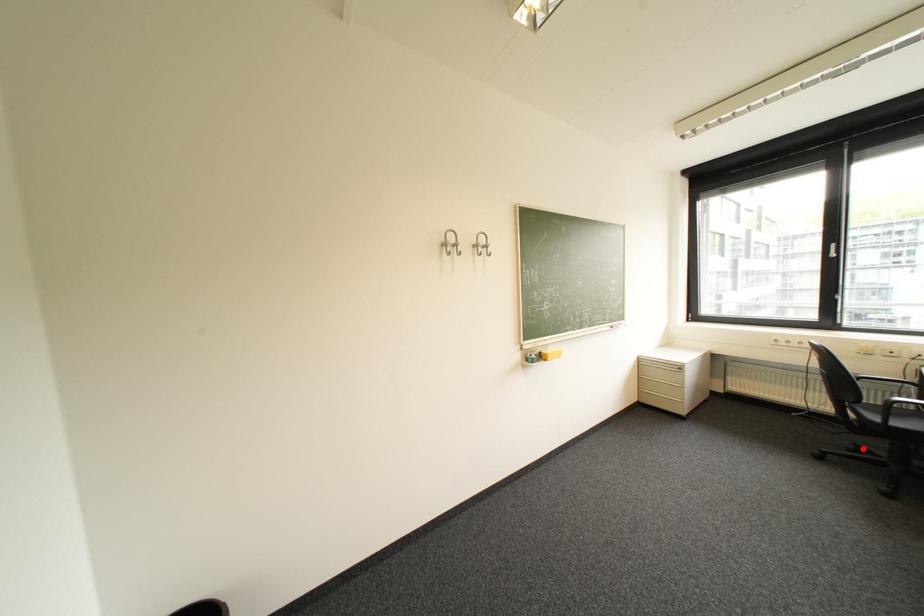
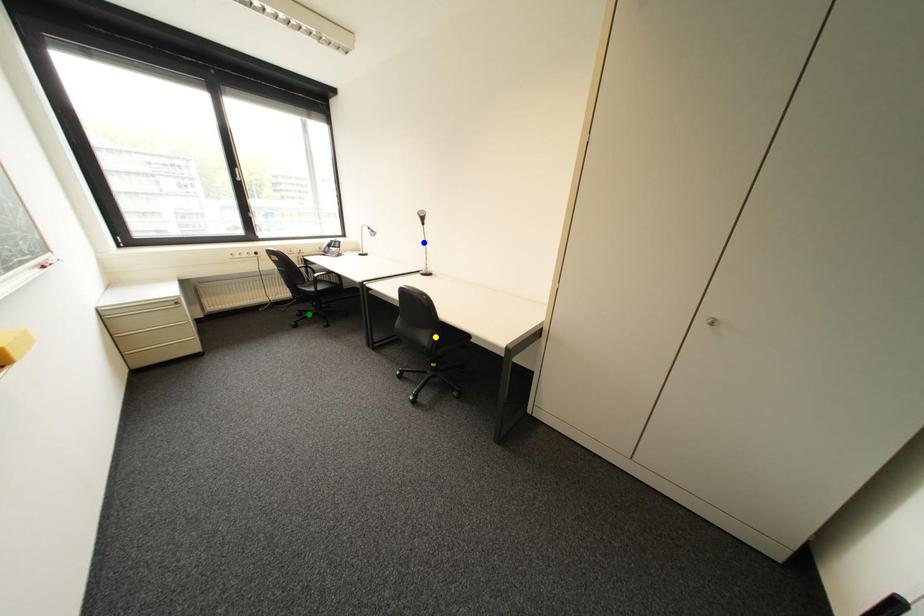
Question: I am providing you with two images of the same scene from different viewpoints. A red point is marked on the first image. You are given multiple points on the second image. Which spot in image 2 lines up with the point in image 1?

Choices:
 (A) yellow point
 (B) blue point
 (C) green point

Answer: (C)